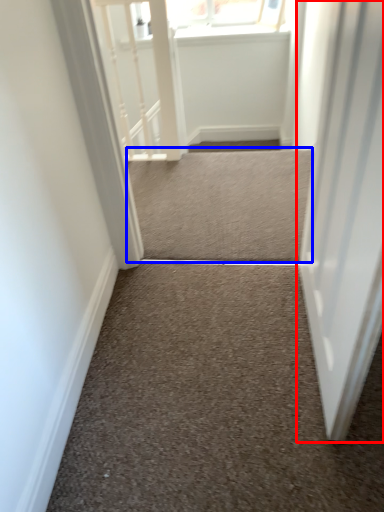
Question: Which point is closer to the camera, door (highlighted by a red box) or stairwell (highlighted by a blue box)?

Choices:
 (A) door
 (B) stairwell

Answer: (A)